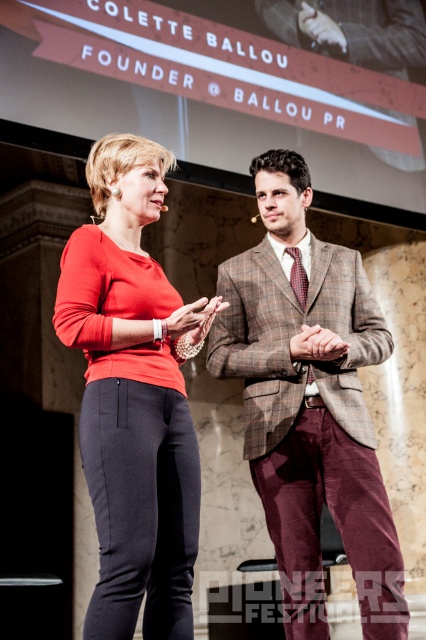
You are standing at the camera position and want to know how far the point at coordinates (282, 248) is from you. Can you determine the distance?

The point at coordinates (282, 248) is 8.99 feet away from the camera position.

You are organizing a photoshoot and need to place a large prop between the plaid wool suit at center and the matte red blouse at center. Based on their sizes, which object should the prop be placed closer to?

The plaid wool suit at center is smaller than the matte red blouse at center, so the large prop should be placed closer to the plaid wool suit at center to balance the composition.